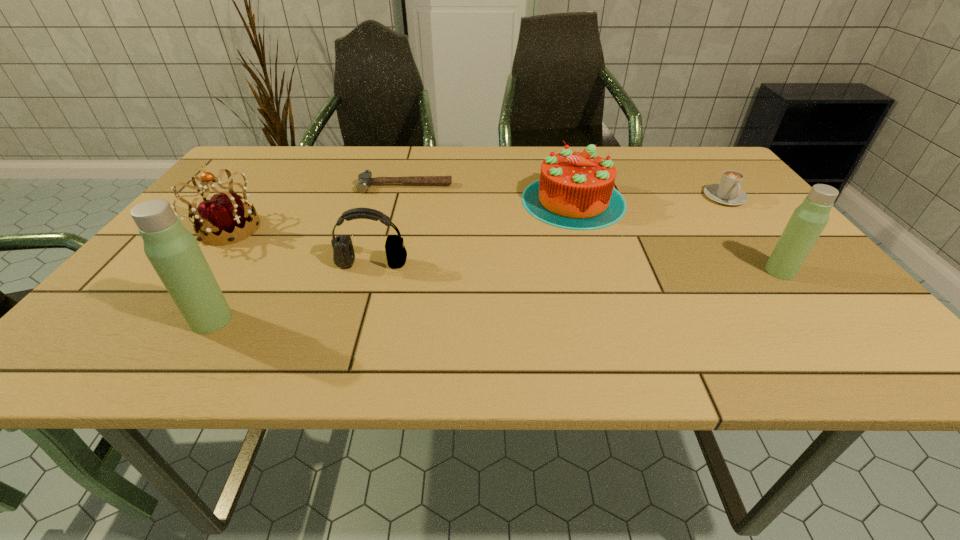
What are the coordinates of `empty space that is in between the headset and the cake` in the screenshot? It's located at pos(472,232).

The image size is (960, 540). I want to click on free space between the shortest object and the tiara, so click(316, 207).

This screenshot has width=960, height=540. I want to click on empty location between the tiara and the headset, so click(300, 246).

Where is `empty space between the sixth tallest object and the headset`? The height and width of the screenshot is (540, 960). empty space between the sixth tallest object and the headset is located at coordinates (548, 231).

Where is `blank region between the cappuccino and the third object from right to left`? The image size is (960, 540). blank region between the cappuccino and the third object from right to left is located at coordinates (649, 199).

Find the location of a particular element. empty location between the headset and the third object from right to left is located at coordinates (472, 232).

This screenshot has height=540, width=960. What are the coordinates of `the sixth closest object to the tiara` in the screenshot? It's located at (809, 219).

Locate which object is the fourth closest to the farther thermos bottle. Please provide its 2D coordinates. Your answer should be formatted as a tuple, i.e. [(x, y)], where the tuple contains the x and y coordinates of a point satisfying the conditions above.

[(343, 252)]

You are a GUI agent. You are given a task and a screenshot of the screen. Output one action in this format:
    pyautogui.click(x=<x>, y=<y>)
    Task: Click on the vacant space that satisfies the following two spatial constraints: 1. on the front-facing side of the tiara; 2. on the left side of the taller thermos bottle
    This screenshot has height=540, width=960.
    Given the screenshot: What is the action you would take?
    pyautogui.click(x=157, y=320)

In order to click on vacant space that satisfies the following two spatial constraints: 1. on the back side of the tallest object; 2. on the front-facing side of the tiara in this screenshot , I will do (269, 229).